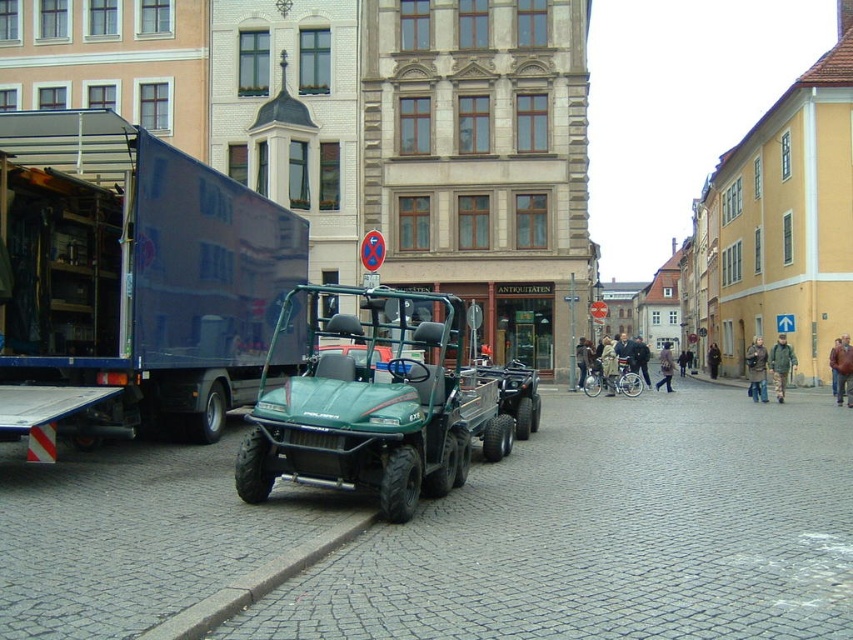
In the scene shown: You are a delivery driver who needs to park your vehicle in this street. You have a new delivery van that is 2 meters tall. The blue metallic truck at left and the green matte utility vehicle at center are already parked. Which vehicle should you avoid parking next to if your van is taller than both?

The blue metallic truck at left is shorter than the green matte utility vehicle at center. Since your van is taller than both, you should avoid parking next to the green matte utility vehicle at center because it is taller and might block your access or visibility.

You are standing at the center of the street in the European town scene. There is a large blue truck parked on the left side. A small red dot is marked at coordinates point (134, 276). Can you tell me where exactly this point is located relative to the blue metallic truck at left?

The point (134, 276) is located on the blue metallic truck at left.

You are a delivery person who needs to park your vehicle in this street. You have two options to choose from. The first option is to park your vehicle in the space where the blue metallic truck at left is currently parked. The second option is to park in the space where the green matte utility vehicle at center is currently parked. Which parking space has more room for your vehicle?

The green matte utility vehicle at center occupies more space than the blue metallic truck at left, so the parking space where the green matte utility vehicle at center is parked has more room for your vehicle.